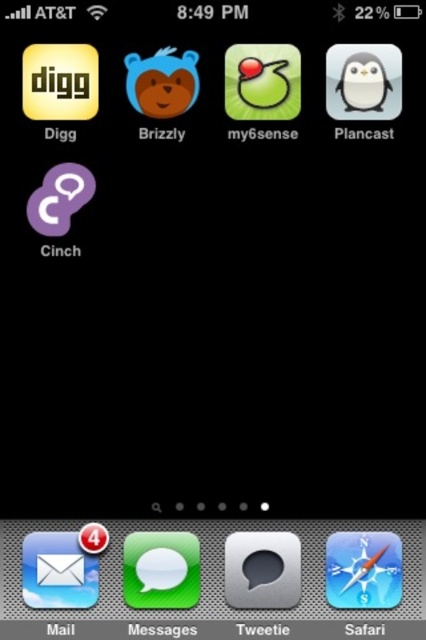
Consider the image. You are holding a smartphone with a green rubber duck at center. If you want to place the duck exactly where the status bar is, would the duck be above or below the status bar?

The green rubber duck at center is positioned at point (262, 81). Since the status bar is at the top of the screen, the duck would be below the status bar.

You are trying to place a small sticker on your phone screen. You have two options for placement areas based on the objects shown. The metallic gray speech bubble at center and the matte plastic bear at upper center. Which object would allow you to place a sticker without covering the entire object?

The matte plastic bear at upper center is smaller than the metallic gray speech bubble at center, so placing a sticker there would require covering less of the object, allowing for a smaller sticker placement without covering the entire object.

You are holding a green rubber duck at center and a matte plastic bear at upper center. Which object is taller?

The green rubber duck at center is much taller than the matte plastic bear at upper center.